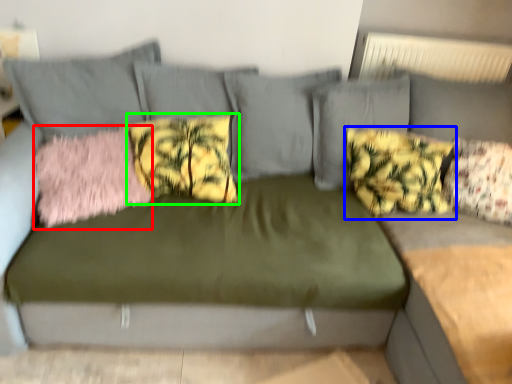
Question: Which object is positioned closest to pillow (highlighted by a red box)? Select from pillow (highlighted by a blue box) and pillow (highlighted by a green box).

Choices:
 (A) pillow
 (B) pillow

Answer: (B)